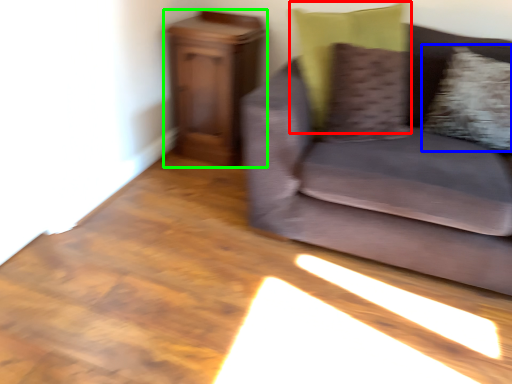
Question: Which is nearer to the pillow (highlighted by a red box)? pillow (highlighted by a blue box) or furniture (highlighted by a green box).

Choices:
 (A) pillow
 (B) furniture

Answer: (A)